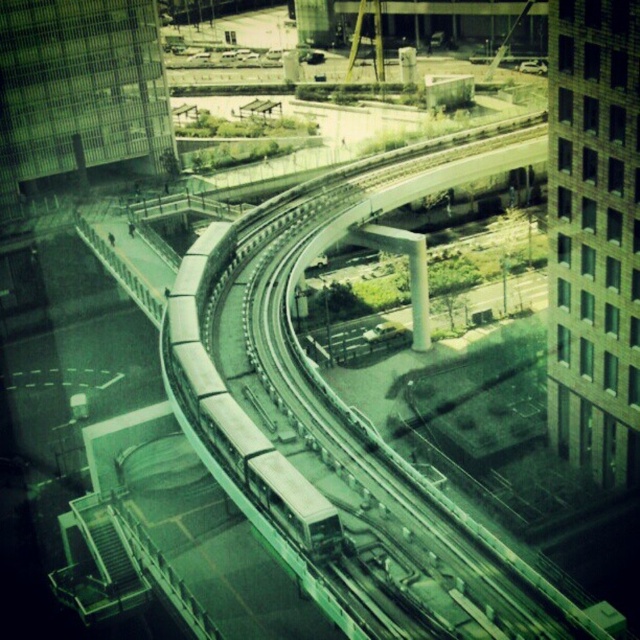
Does green concrete train track at center have a larger size compared to metallic silver train at center?

Indeed, green concrete train track at center has a larger size compared to metallic silver train at center.

Who is more forward, (397, 572) or (234, 458)?

Point (397, 572) is more forward.

Describe the element at coordinates (342, 417) in the screenshot. I see `green concrete train track at center` at that location.

You are a GUI agent. You are given a task and a screenshot of the screen. Output one action in this format:
    pyautogui.click(x=<x>, y=<y>)
    Task: Click on the green concrete train track at center
    This screenshot has width=640, height=640.
    Given the screenshot: What is the action you would take?
    [342, 417]